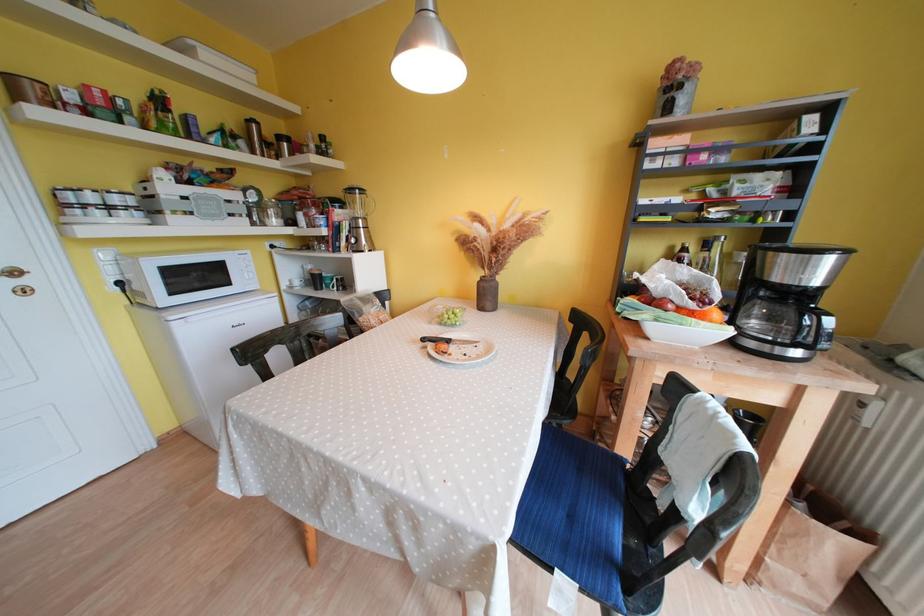
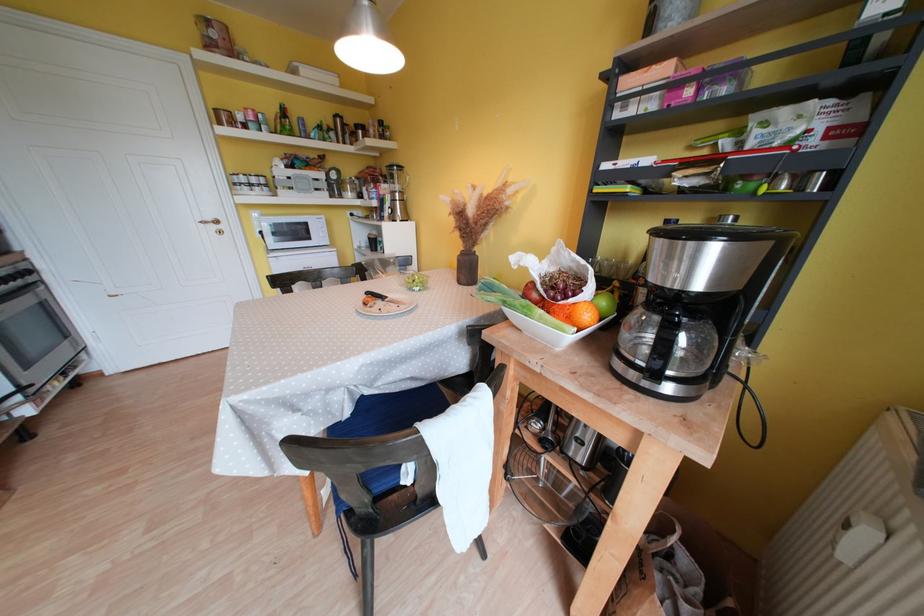
Where in the second image is the point corresponding to (454,344) from the first image?

(390, 301)